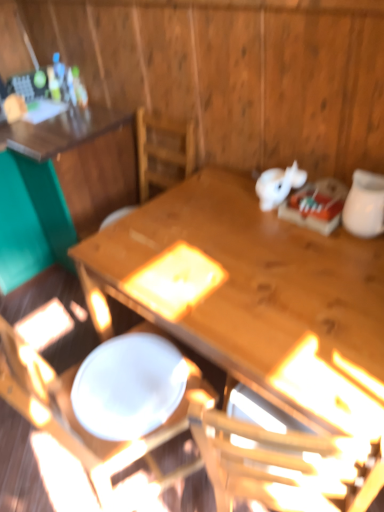
Question: Considering the positions of wooden chair at center and wooden table at upper left, the 1th table when ordered from left to right, in the image, is wooden chair at center taller or shorter than wooden table at upper left, the 1th table when ordered from left to right,?

Choices:
 (A) tall
 (B) short

Answer: (A)

Question: Visually, is wooden chair at center positioned to the left or to the right of wooden table at upper left, which appears as the 2th table when viewed from the right?

Choices:
 (A) right
 (B) left

Answer: (A)

Question: Which of these objects is positioned closest to the wooden chair at center?

Choices:
 (A) white glossy plate at center
 (B) white glossy jar at upper right
 (C) wooden table at center, the 1th table positioned from the right
 (D) wooden table at upper left, which appears as the 2th table when viewed from the right

Answer: (A)

Question: Considering the real-world distances, which object is farthest from the white glossy plate at center?

Choices:
 (A) white glossy jar at upper right
 (B) wooden chair at center
 (C) wooden table at upper left, which appears as the 2th table when viewed from the right
 (D) wooden table at center, which is the 2th table in left-to-right order

Answer: (C)